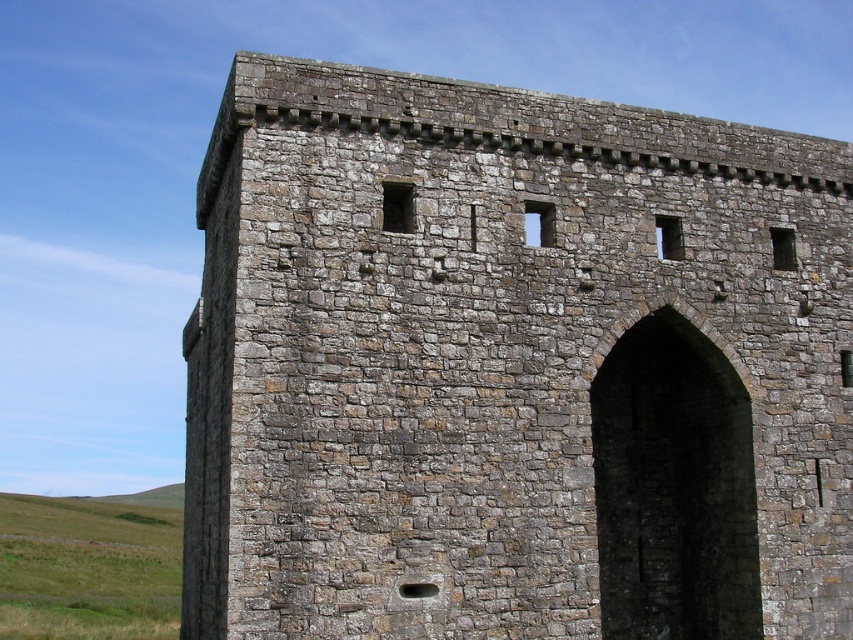
You are standing in front of the brown stone wall at center and the green grass at lower left. Which object is taller?

The brown stone wall at center is much taller than the green grass at lower left.

You are standing in front of the stone wall and see the point marked at coordinates (514, 368). Based on the scene description, can you determine what surface this point is located on?

The point is located on the brown stone wall at center, which is part of the historical fortification structure described in the scene.